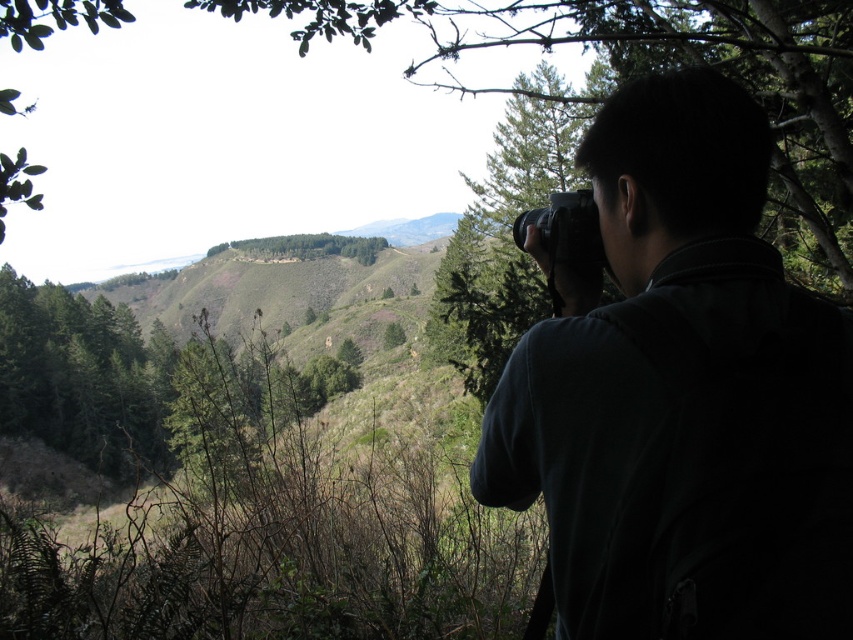
You are an environmental scientist assessing the biodiversity of this forest area. You notice the green textured tree at upper right and the green leafy trees at center. Which of these trees is more likely to be a younger sapling based on their size?

The green textured tree at upper right has a smaller size compared to the green leafy trees at center, indicating it is more likely to be a younger sapling.

You are an outdoor photographer planning to capture the green textured tree at upper right and the green leafy trees at center in a single shot. Based on their positions, which tree group will appear closer to the camera in the final photo?

The green textured tree at upper right will appear closer to the camera because it is positioned in front of the green leafy trees at center.